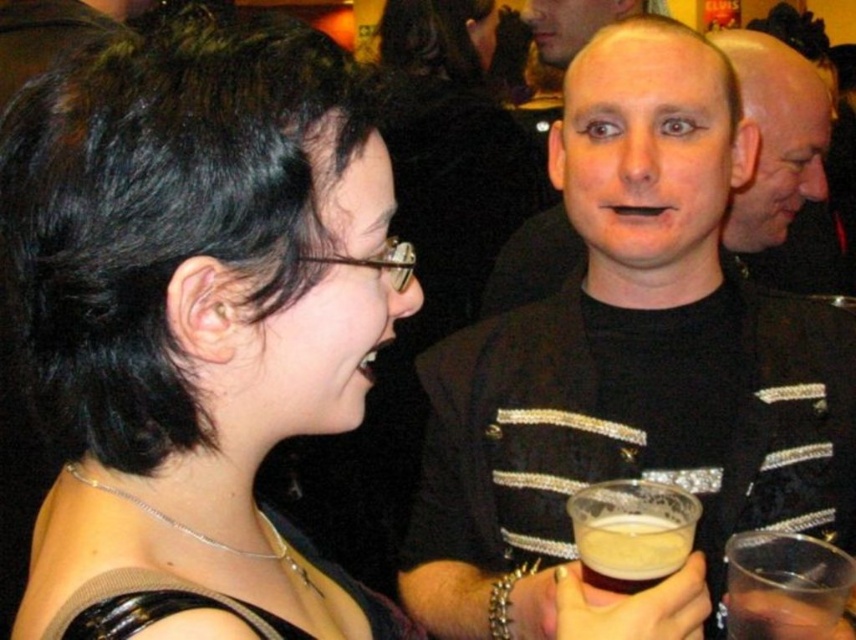
Question: Can you confirm if smooth bald head at upper right is wider than matte skin face at upper center?

Choices:
 (A) yes
 (B) no

Answer: (A)

Question: Where is black matte jacket at center located in relation to brown frothy liquid at center in the image?

Choices:
 (A) right
 (B) left

Answer: (A)

Question: Which of the following is the closest to the observer?

Choices:
 (A) (389, 292)
 (B) (182, 346)
 (C) (768, 97)

Answer: (B)

Question: Which point is farther from the camera taking this photo?

Choices:
 (A) (811, 172)
 (B) (538, 8)
 (C) (755, 228)

Answer: (B)

Question: Can you confirm if black matte hair at upper left is wider than black matte jacket at center?

Choices:
 (A) yes
 (B) no

Answer: (B)

Question: Which object is positioned closest to the black textured jacket at center?

Choices:
 (A) translucent plastic cup at lower right
 (B) smooth bald head at upper right
 (C) black matte jacket at center

Answer: (A)